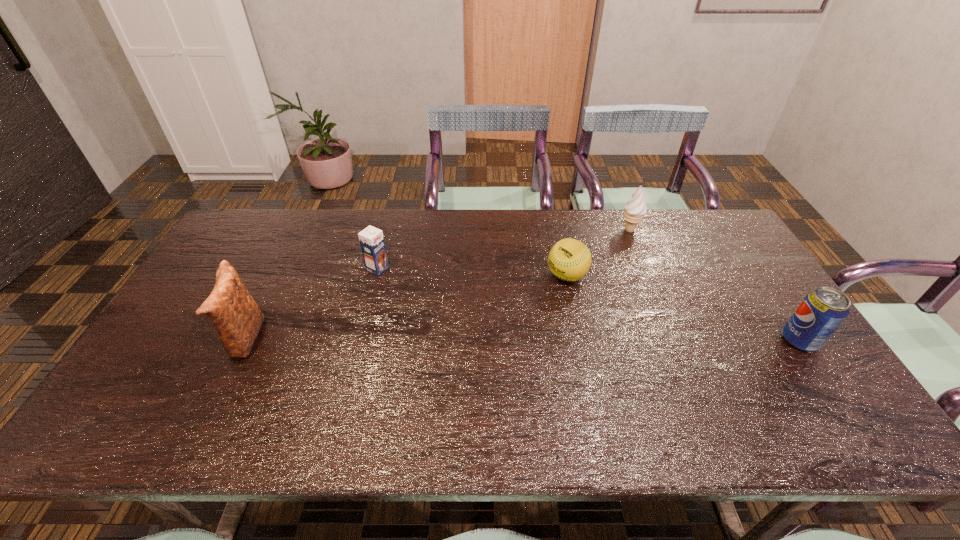
The width and height of the screenshot is (960, 540). In order to click on free spot on the desktop that is between the leftmost object and the soda and is positioned on the logo side of the shortest object in this screenshot , I will do `click(475, 340)`.

This screenshot has width=960, height=540. Identify the location of vacant space on the desktop that is between the leftmost object and the rightmost object and is positioned on the front-facing side of the farthest object. point(532,340).

Find the location of a particular element. free space on the desktop that is between the leftmost object and the rightmost object and is positioned on the front label of the chocolate milk is located at coordinates (527, 340).